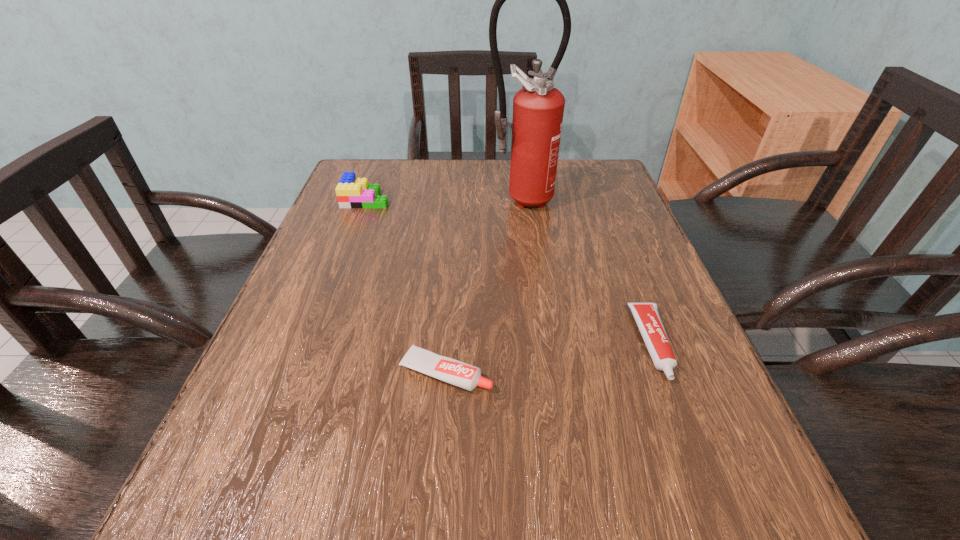
Find the location of a particular element. The image size is (960, 540). Lego at the far edge is located at coordinates (352, 192).

Locate an element on the screen. This screenshot has width=960, height=540. object at the left edge is located at coordinates (352, 192).

Identify the location of object present at the right edge. (646, 315).

Identify the location of object at the far left corner. Image resolution: width=960 pixels, height=540 pixels. (x=352, y=192).

In the image, there is a desktop. In order to click on vacant space at the far edge in this screenshot , I will do click(x=479, y=182).

The height and width of the screenshot is (540, 960). What are the coordinates of `vacant space at the near edge of the desktop` in the screenshot? It's located at (484, 522).

Where is `blank area at the left edge`? Image resolution: width=960 pixels, height=540 pixels. blank area at the left edge is located at coordinates (281, 326).

Image resolution: width=960 pixels, height=540 pixels. I want to click on blank space at the right edge of the desktop, so click(x=686, y=452).

Where is `free space at the near left corner of the desktop`? free space at the near left corner of the desktop is located at coordinates [x=265, y=500].

The height and width of the screenshot is (540, 960). Find the location of `vacant space at the far right corner`. vacant space at the far right corner is located at coordinates (568, 178).